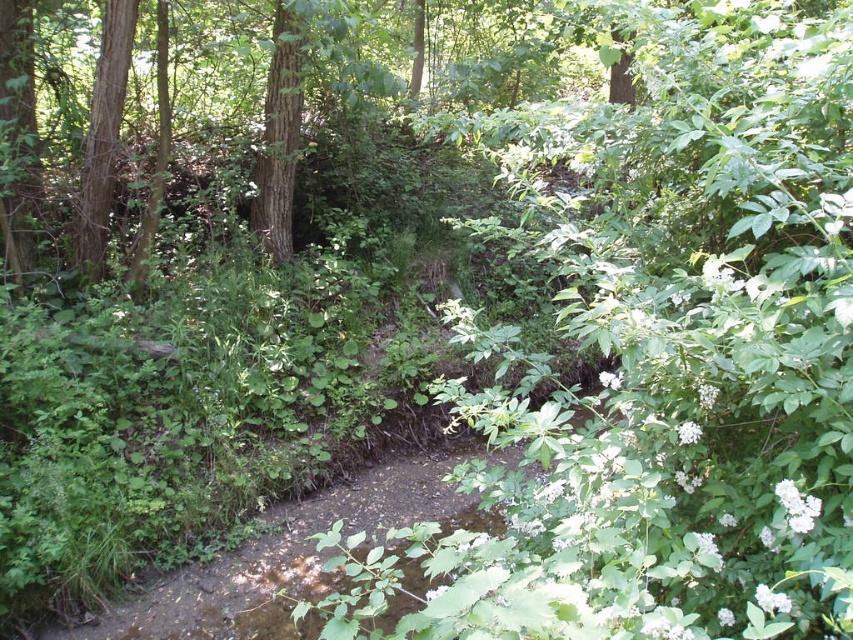
This screenshot has width=853, height=640. What do you see at coordinates (103, 136) in the screenshot?
I see `smooth brown tree trunk at left` at bounding box center [103, 136].

Can you confirm if smooth brown tree trunk at left is positioned below green rough bark tree at center?

Yes, smooth brown tree trunk at left is below green rough bark tree at center.

Is point (113, 84) farther from viewer compared to point (277, 256)?

No, it is in front of (277, 256).

Locate an element on the screen. The image size is (853, 640). smooth brown tree trunk at left is located at coordinates click(103, 136).